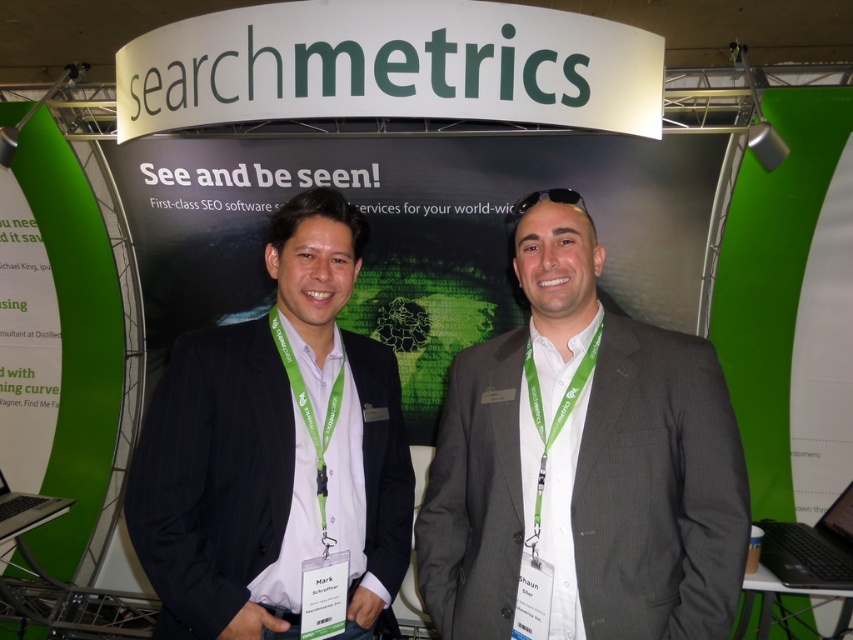
Question: Where is dark blue suit at center located in relation to silver metallic laptop at lower left in the image?

Choices:
 (A) left
 (B) right

Answer: (B)

Question: Which point is closer to the camera?

Choices:
 (A) (355, 428)
 (B) (486, 400)
 (C) (825, 570)

Answer: (B)

Question: Among these objects, which one is farthest from the camera?

Choices:
 (A) dark blue suit at center
 (B) silver metallic laptop at lower left
 (C) black plastic laptop at lower right
 (D) gray pinstripe suit at center

Answer: (B)

Question: Among these objects, which one is nearest to the camera?

Choices:
 (A) black plastic laptop at lower right
 (B) silver metallic laptop at lower left
 (C) gray pinstripe suit at center
 (D) dark blue suit at center

Answer: (C)

Question: Does gray pinstripe suit at center come in front of silver metallic laptop at lower left?

Choices:
 (A) no
 (B) yes

Answer: (B)

Question: Is gray pinstripe suit at center positioned in front of dark blue suit at center?

Choices:
 (A) no
 (B) yes

Answer: (B)